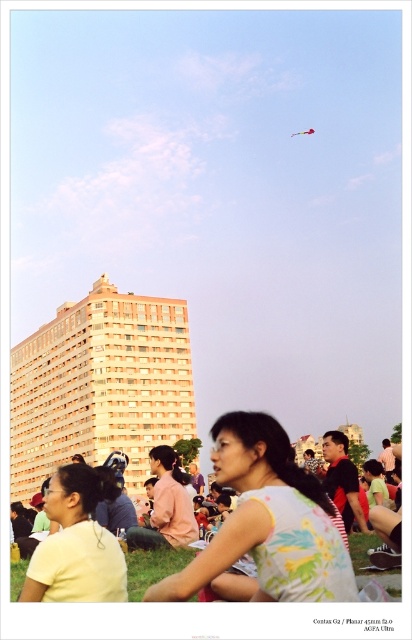
Which is below, yellow matte shirt at lower left or green grass at lower center?

green grass at lower center

Between point (72, 556) and point (128, 577), which one is positioned behind?

Point (128, 577)

Find the location of a particular element. The width and height of the screenshot is (412, 640). yellow matte shirt at lower left is located at coordinates (77, 541).

Who is positioned more to the right, floral printed dress at center or green grass at lower center?

floral printed dress at center

Can you confirm if floral printed dress at center is positioned below green grass at lower center?

No, floral printed dress at center is not below green grass at lower center.

Between point (316, 545) and point (128, 595), which one is positioned in front?

Point (316, 545) is in front.

The width and height of the screenshot is (412, 640). I want to click on floral printed dress at center, so click(267, 522).

Can you confirm if green grass at lower center is smaller than multicolored fabric kite at upper center?

No.

The image size is (412, 640). What do you see at coordinates (154, 566) in the screenshot?
I see `green grass at lower center` at bounding box center [154, 566].

Where is `green grass at lower center`? Image resolution: width=412 pixels, height=640 pixels. green grass at lower center is located at coordinates (154, 566).

The width and height of the screenshot is (412, 640). Identify the location of green grass at lower center. (154, 566).